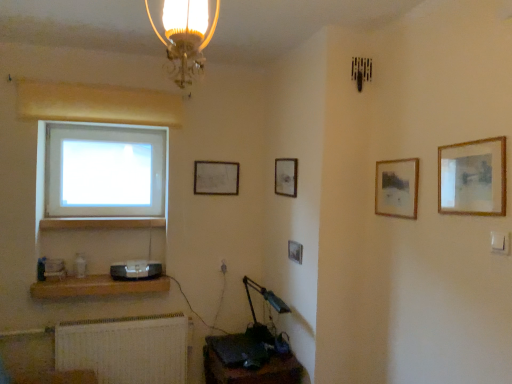
What do you see at coordinates (223, 267) in the screenshot? The image size is (512, 384). I see `white plastic electric outlet at lower center` at bounding box center [223, 267].

What do you see at coordinates (185, 36) in the screenshot? I see `gold glass chandelier at upper center` at bounding box center [185, 36].

Measure the distance between white textured radiator at lower left and camera.

They are 2.60 meters apart.

What is the approximate width of wooden at lower left?

wooden at lower left is 3.66 inches in width.

Describe the element at coordinates (286, 177) in the screenshot. Image resolution: width=512 pixels, height=384 pixels. I see `wooden picture frame at upper center, positioned as the 2th picture frame in left-to-right order` at that location.

Locate an element on the screen. The image size is (512, 384). wooden picture frame at upper center, which appears as the 4th picture frame when viewed from the right is located at coordinates (286, 177).

Identify the location of white plastic electric outlet at lower center. (223, 267).

Is wooden framed picture at upper right, the 4th picture frame positioned from the left, oriented away from wooden picture frame at center, the third picture frame when ordered from right to left?

No, wooden framed picture at upper right, the 4th picture frame positioned from the left, is not facing away from wooden picture frame at center, the third picture frame when ordered from right to left.

Is wooden picture frame at center, which ranks as the 3th picture frame in back-to-front order, completely or partially inside wooden framed picture at upper right, the 4th picture frame positioned from the left?

Definitely not — wooden picture frame at center, which ranks as the 3th picture frame in back-to-front order, is not inside wooden framed picture at upper right, the 4th picture frame positioned from the left.

Which of these two, wooden framed picture at upper right, arranged as the fourth picture frame when viewed from the back, or wooden picture frame at center, which is counted as the 3th picture frame, starting from the front, is bigger?

Bigger between the two is wooden framed picture at upper right, arranged as the fourth picture frame when viewed from the back.

Which is more to the right, wooden framed picture at upper right, the 4th picture frame positioned from the left, or wooden picture frame at center, the third picture frame when ordered from right to left?

Positioned to the right is wooden framed picture at upper right, the 4th picture frame positioned from the left.

Is point (76, 218) farther from camera compared to point (39, 284)?

That is True.

In terms of height, does wooden at lower left look taller or shorter compared to brown wooden shelf at lower left?

wooden at lower left is shorter than brown wooden shelf at lower left.

Looking at this image, from the image's perspective, is wooden at lower left located above or below brown wooden shelf at lower left?

wooden at lower left is situated higher than brown wooden shelf at lower left in the image.

Can you tell me how much wooden at lower left and brown wooden shelf at lower left differ in facing direction?

0.881 degrees separate the facing orientations of wooden at lower left and brown wooden shelf at lower left.

Are metallic blue table lamp at lower center and wooden picture frame at upper center, positioned as the 2th picture frame in left-to-right order, beside each other?

No, metallic blue table lamp at lower center is not in contact with wooden picture frame at upper center, positioned as the 2th picture frame in left-to-right order.

How many degrees apart are the facing directions of metallic blue table lamp at lower center and wooden picture frame at upper center, positioned as the 2th picture frame in left-to-right order?

The angle between the facing direction of metallic blue table lamp at lower center and the facing direction of wooden picture frame at upper center, positioned as the 2th picture frame in left-to-right order, is 0.992 degrees.

Considering the relative sizes of metallic blue table lamp at lower center and wooden picture frame at upper center, the 4th picture frame viewed from the front, in the image provided, is metallic blue table lamp at lower center thinner than wooden picture frame at upper center, the 4th picture frame viewed from the front,?

No, metallic blue table lamp at lower center is not thinner than wooden picture frame at upper center, the 4th picture frame viewed from the front.

In the scene shown: From a real-world perspective, is metallic blue table lamp at lower center physically located above or below wooden picture frame at upper center, the 4th picture frame viewed from the front?

metallic blue table lamp at lower center is situated lower than wooden picture frame at upper center, the 4th picture frame viewed from the front, in the real world.

Considering the positions of point (111, 266) and point (290, 358), is point (111, 266) closer or farther from the camera than point (290, 358)?

Point (111, 266) appears to be farther away from the viewer than point (290, 358).

Based on the photo, are satin black speaker at lower left and dark brown wooden desk at lower center far apart?

No, satin black speaker at lower left is not far away from dark brown wooden desk at lower center.

Which of these two, satin black speaker at lower left or dark brown wooden desk at lower center, stands shorter?

satin black speaker at lower left is shorter.

Between satin black speaker at lower left and dark brown wooden desk at lower center, which one appears on the left side from the viewer's perspective?

satin black speaker at lower left.

Is wooden framed picture at upper right, arranged as the fourth picture frame when viewed from the back, not near wooden frame at upper right, which is the fifth picture frame from left to right?

No, wooden framed picture at upper right, arranged as the fourth picture frame when viewed from the back, is not far from wooden frame at upper right, which is the fifth picture frame from left to right.

From a real-world perspective, between wooden framed picture at upper right, the 4th picture frame positioned from the left, and wooden frame at upper right, which is the fifth picture frame from left to right, who is vertically higher?

wooden frame at upper right, which is the fifth picture frame from left to right.

Is wooden framed picture at upper right, the 2th picture frame viewed from the front, smaller than wooden frame at upper right, the first picture frame viewed from the front?

Indeed, wooden framed picture at upper right, the 2th picture frame viewed from the front, has a smaller size compared to wooden frame at upper right, the first picture frame viewed from the front.

Measure the distance from wooden picture frame at upper center, the 4th picture frame viewed from the front, to wooden framed picture at upper right, arranged as the fourth picture frame when viewed from the back.

wooden picture frame at upper center, the 4th picture frame viewed from the front, is 25.83 inches away from wooden framed picture at upper right, arranged as the fourth picture frame when viewed from the back.

Between wooden picture frame at upper center, positioned as the 2th picture frame in left-to-right order, and wooden framed picture at upper right, arranged as the fourth picture frame when viewed from the back, which one has less height?

wooden picture frame at upper center, positioned as the 2th picture frame in left-to-right order, is shorter.

How different are the orientations of wooden picture frame at upper center, positioned as the 2th picture frame in left-to-right order, and wooden framed picture at upper right, which is the 2th picture frame in right-to-left order, in degrees?

The angular difference between wooden picture frame at upper center, positioned as the 2th picture frame in left-to-right order, and wooden framed picture at upper right, which is the 2th picture frame in right-to-left order, is 3.71 degrees.

From the image's perspective, is wooden picture frame at upper center, positioned as the 2th picture frame in left-to-right order, above or below wooden framed picture at upper right, which is the 2th picture frame in right-to-left order?

wooden picture frame at upper center, positioned as the 2th picture frame in left-to-right order, is situated higher than wooden framed picture at upper right, which is the 2th picture frame in right-to-left order, in the image.

Considering the relative positions of brown wooden shelf at lower left and transparent glass window at left in the image provided, is brown wooden shelf at lower left to the left or to the right of transparent glass window at left?

brown wooden shelf at lower left is to the right of transparent glass window at left.

Is point (100, 288) behind point (45, 170)?

No, it is not.

The image size is (512, 384). I want to click on shelf in front of the transparent glass window at left, so click(96, 287).

Which of these two, brown wooden shelf at lower left or transparent glass window at left, stands taller?

Answer: With more height is transparent glass window at left.

Which picture frame is the 1st one when counting from the right side of the wooden picture frame at center, which ranks as the third picture frame in left-to-right order? Please provide its 2D coordinates.

[(397, 188)]

Identify the location of shelf that is below the wooden at lower left (from the image's perspective). Image resolution: width=512 pixels, height=384 pixels. (96, 287).

When comparing their distances from wooden at lower left, does dark brown wooden desk at lower center or brown wooden shelf at lower left seem further?

dark brown wooden desk at lower center is further to wooden at lower left.

Considering their positions, is brown wooden shelf at lower left positioned further to wooden frame at upper right, arranged as the 1th picture frame when viewed from the right, than white textured radiator at lower left?

Based on the image, white textured radiator at lower left appears to be further to wooden frame at upper right, arranged as the 1th picture frame when viewed from the right.

When comparing their distances from gold glass chandelier at upper center, does wooden picture frame at center, which ranks as the third picture frame in left-to-right order, or wooden framed picture at upper right, the 4th picture frame positioned from the left, seem further?

Among the two, wooden picture frame at center, which ranks as the third picture frame in left-to-right order, is located further to gold glass chandelier at upper center.

When comparing their distances from brown wooden shelf at lower left, does wooden picture frame at upper center, which is counted as the 2th picture frame, starting from the back, or white plastic electric outlet at lower center seem further?

Based on the image, wooden picture frame at upper center, which is counted as the 2th picture frame, starting from the back, appears to be further to brown wooden shelf at lower left.

Considering their positions, is wooden frame at upper right, the 5th picture frame when ordered from back to front, positioned further to white textured radiator at lower left than wooden framed picture at upper right, the 2th picture frame viewed from the front?

wooden frame at upper right, the 5th picture frame when ordered from back to front, lies further to white textured radiator at lower left than the other object.

Looking at the image, which one is located further to wooden picture frame at center, which ranks as the 3th picture frame in back-to-front order, transparent glass window at left or wooden framed picture at upper right, arranged as the fourth picture frame when viewed from the back?

Based on the image, transparent glass window at left appears to be further to wooden picture frame at center, which ranks as the 3th picture frame in back-to-front order.

When comparing their distances from wooden framed picture at upper right, the 4th picture frame positioned from the left, does wooden picture frame at upper center, which appears as the 4th picture frame when viewed from the right, or transparent glass window at left seem closer?

The object closer to wooden framed picture at upper right, the 4th picture frame positioned from the left, is wooden picture frame at upper center, which appears as the 4th picture frame when viewed from the right.

From the picture: From the image, which object appears to be farther from white plastic electric outlet at lower center, brown wooden shelf at lower left or wooden frame at upper right, arranged as the 1th picture frame when viewed from the right?

The object further to white plastic electric outlet at lower center is wooden frame at upper right, arranged as the 1th picture frame when viewed from the right.

Locate an element on the screen. The width and height of the screenshot is (512, 384). table lamp between matte silver picture frame at upper center, which appears as the 1th picture frame when viewed from the back, and white textured radiator at lower left from top to bottom is located at coordinates (264, 299).

At what (x,y) coordinates should I click in order to perform the action: click on appliance between transparent glass window at left and wooden picture frame at upper center, positioned as the 2th picture frame in left-to-right order. Please return your answer as a coordinate pair (x, y). Looking at the image, I should click on (136, 270).

The image size is (512, 384). Find the location of `appliance between wooden at lower left and wooden picture frame at upper center, the 4th picture frame viewed from the front, in the horizontal direction`. appliance between wooden at lower left and wooden picture frame at upper center, the 4th picture frame viewed from the front, in the horizontal direction is located at coordinates (136, 270).

Identify the location of shelf between gold glass chandelier at upper center and white plastic electric outlet at lower center along the z-axis. (96, 287).